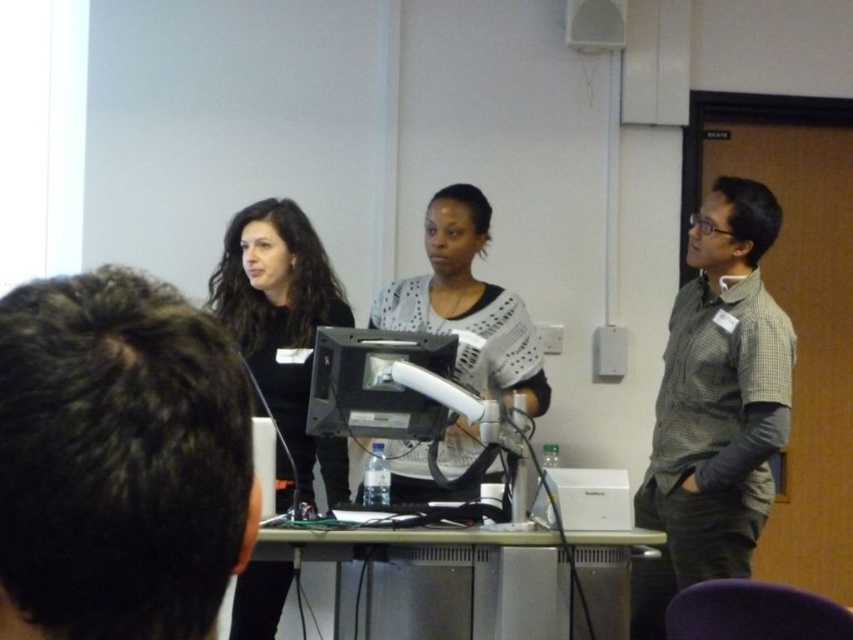
Which is more to the right, dark brown hair at upper left or matte black shirt at center?

From the viewer's perspective, dark brown hair at upper left appears more on the right side.

Can you confirm if dark brown hair at upper left is smaller than matte black shirt at center?

Indeed, dark brown hair at upper left has a smaller size compared to matte black shirt at center.

Is point (97, 403) in front of point (337, 483)?

Yes, it is.

I want to click on dark brown hair at upper left, so click(119, 458).

Is checkered fabric shirt at right bigger than white dotted sweater at center?

Correct, checkered fabric shirt at right is larger in size than white dotted sweater at center.

Is checkered fabric shirt at right to the right of white dotted sweater at center from the viewer's perspective?

Indeed, checkered fabric shirt at right is positioned on the right side of white dotted sweater at center.

You are a GUI agent. You are given a task and a screenshot of the screen. Output one action in this format:
    pyautogui.click(x=<x>, y=<y>)
    Task: Click on the checkered fabric shirt at right
    
    Given the screenshot: What is the action you would take?
    pyautogui.click(x=715, y=404)

Which is behind, point (267, 380) or point (459, 452)?

The point (459, 452) is behind.

Can you confirm if matte black shirt at center is bigger than white dotted sweater at center?

Indeed, matte black shirt at center has a larger size compared to white dotted sweater at center.

Where is `matte black shirt at center`? matte black shirt at center is located at coordinates (282, 332).